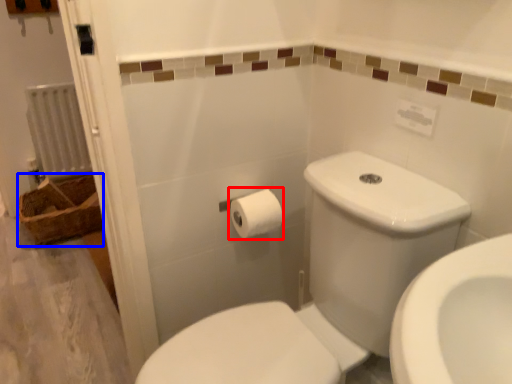
Question: Among these objects, which one is nearest to the camera, toilet paper (highlighted by a red box) or basket (highlighted by a blue box)?

Choices:
 (A) toilet paper
 (B) basket

Answer: (A)